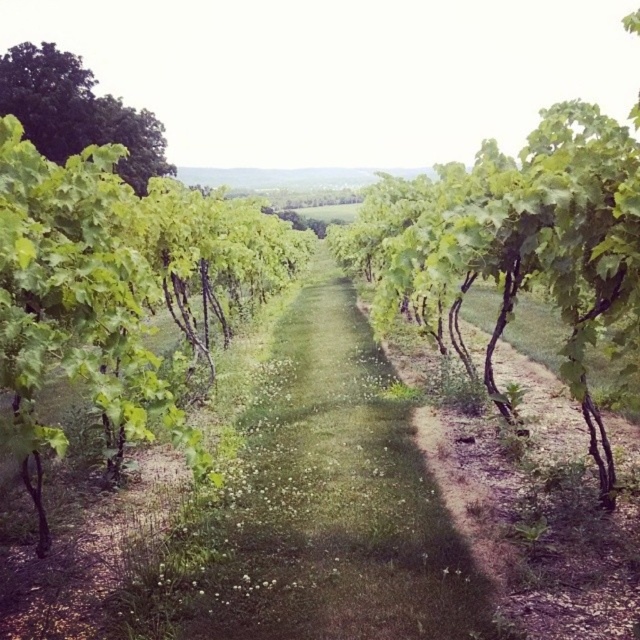
Question: Based on their relative distances, which object is farther from the green leafy tree at center?

Choices:
 (A) green leafy tree at upper left
 (B) green leafy vine at center
 (C) green grass at center

Answer: (A)

Question: Can you confirm if green leafy tree at center is positioned above green leafy tree at upper left?

Choices:
 (A) yes
 (B) no

Answer: (B)

Question: Does green grass at center appear under green leafy vine at center?

Choices:
 (A) no
 (B) yes

Answer: (B)

Question: Where is green grass at center located in relation to green leafy tree at upper left in the image?

Choices:
 (A) below
 (B) above

Answer: (A)

Question: Which of the following is the closest to the observer?

Choices:
 (A) green grass at center
 (B) green leafy tree at upper left

Answer: (A)

Question: Estimate the real-world distances between objects in this image. Which object is closer to the green grass at center?

Choices:
 (A) green leafy tree at upper left
 (B) green leafy vine at center
 (C) green leafy tree at center

Answer: (C)